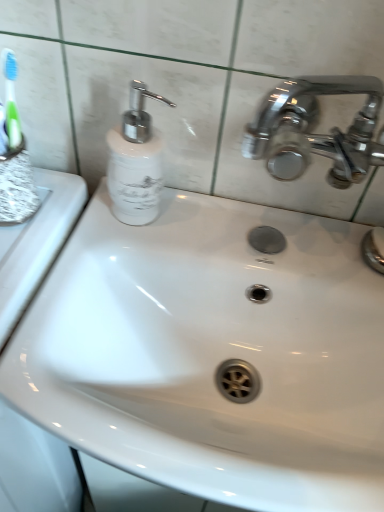
Question: In the image, is polished chrome faucet at upper right on the left side or the right side of white glossy soap dispenser at upper left?

Choices:
 (A) right
 (B) left

Answer: (A)

Question: In terms of height, does polished chrome faucet at upper right look taller or shorter compared to white glossy soap dispenser at upper left?

Choices:
 (A) short
 (B) tall

Answer: (A)

Question: Based on their sizes in the image, would you say polished chrome faucet at upper right is bigger or smaller than white glossy soap dispenser at upper left?

Choices:
 (A) big
 (B) small

Answer: (B)

Question: From a real-world perspective, relative to polished chrome faucet at upper right, is white glossy soap dispenser at upper left vertically above or below?

Choices:
 (A) above
 (B) below

Answer: (A)

Question: Is white glossy soap dispenser at upper left bigger or smaller than polished chrome faucet at upper right?

Choices:
 (A) small
 (B) big

Answer: (B)

Question: Considering the positions of white glossy soap dispenser at upper left and polished chrome faucet at upper right in the image, is white glossy soap dispenser at upper left wider or thinner than polished chrome faucet at upper right?

Choices:
 (A) wide
 (B) thin

Answer: (A)

Question: From the image's perspective, relative to polished chrome faucet at upper right, is white glossy soap dispenser at upper left above or below?

Choices:
 (A) below
 (B) above

Answer: (B)